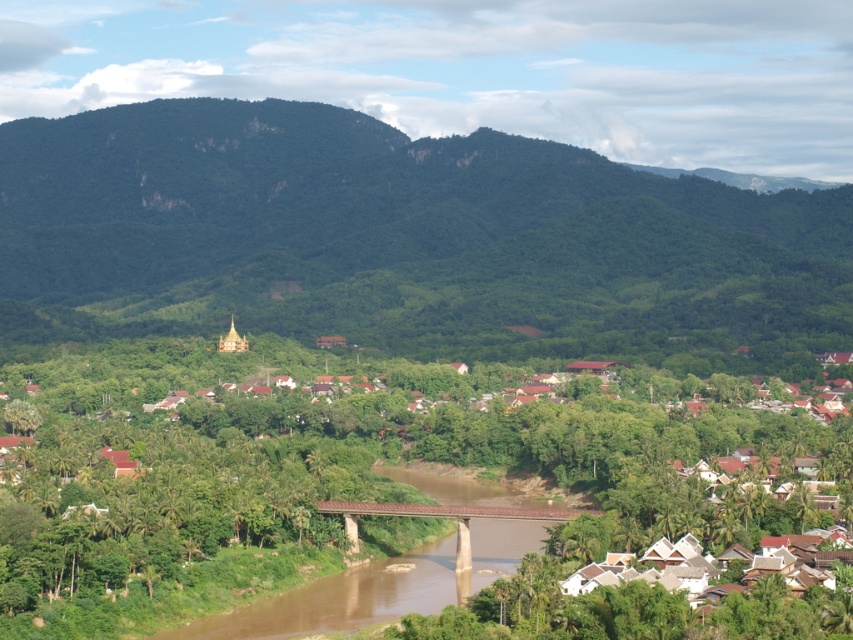
You are planning to build a model of the landscape described. The white matte houses at center and the brown concrete bridge at center are key elements. If you want to maintain the scale accurately, which of the two should be constructed first based on their relative sizes?

The white matte houses at center should be constructed first because they are larger in size than the brown concrete bridge at center, so scaling them appropriately will set the foundation for the bridge.

You are a hiker planning to cross the brown concrete bridge at center to reach the green leafy forest at upper center. Considering the size difference between them, which one would you encounter first as you approach from the riverbank?

You would encounter the brown concrete bridge at center first because it is smaller and closer to the riverbank, while the green leafy forest at upper center is larger and further away.

You are an architect designing a new hiking trail that needs to pass through the green leafy forest at upper center. Based on the image, what are the coordinates of this forest area to ensure accurate mapping?

The green leafy forest at upper center is located at coordinates point (403,241).